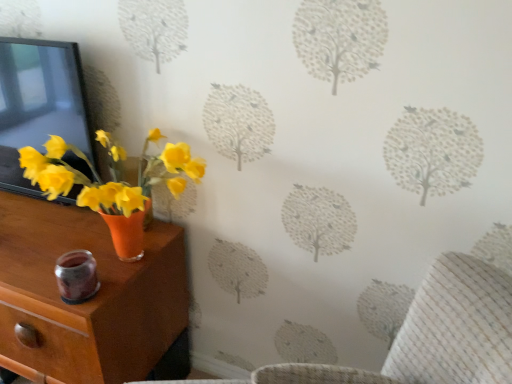
What do you see at coordinates (39, 104) in the screenshot?
I see `matte black picture frame at left` at bounding box center [39, 104].

This screenshot has height=384, width=512. Find the location of `matte black picture frame at left`. matte black picture frame at left is located at coordinates (39, 104).

Describe the element at coordinates (89, 300) in the screenshot. This screenshot has width=512, height=384. I see `orange matte vase at left` at that location.

Image resolution: width=512 pixels, height=384 pixels. I want to click on orange matte vase at left, so click(x=89, y=300).

In order to click on matte black picture frame at left in this screenshot , I will do `click(39, 104)`.

Considering the relative positions of matte black picture frame at left and orange matte vase at left in the image provided, is matte black picture frame at left to the left of orange matte vase at left from the viewer's perspective?

No.

Is the position of matte black picture frame at left more distant than that of orange matte vase at left?

Yes, the depth of matte black picture frame at left is greater than that of orange matte vase at left.

Considering the positions of point (72, 143) and point (16, 255), is point (72, 143) closer or farther from the camera than point (16, 255)?

Clearly, point (72, 143) is more distant from the camera than point (16, 255).

From the image's perspective, is matte black picture frame at left located above or below orange matte vase at left?

Clearly, from the image's perspective, matte black picture frame at left is above orange matte vase at left.

From a real-world perspective, is matte black picture frame at left over orange matte vase at left?

Indeed, from a real-world perspective, matte black picture frame at left stands above orange matte vase at left.

From the picture: Can you confirm if matte black picture frame at left is thinner than orange matte vase at left?

Yes, matte black picture frame at left is thinner than orange matte vase at left.

From their relative heights in the image, would you say matte black picture frame at left is taller or shorter than orange matte vase at left?

Considering their sizes, matte black picture frame at left has less height than orange matte vase at left.

Between matte black picture frame at left and orange matte vase at left, which one has smaller size?

matte black picture frame at left is smaller.

Could orange matte vase at left be considered to be inside matte black picture frame at left?

That's incorrect, orange matte vase at left is not inside matte black picture frame at left.

Is there a large distance between matte black picture frame at left and orange matte vase at left?

matte black picture frame at left is near orange matte vase at left, not far away.

Could you tell me if matte black picture frame at left is turned towards orange matte vase at left?

No.

How different are the orientations of matte black picture frame at left and orange matte vase at left in degrees?

There is a 2.09-degree angle between the facing directions of matte black picture frame at left and orange matte vase at left.

At what (x,y) coordinates should I click in order to perform the action: click on picture frame above the orange matte vase at left (from the image's perspective). Please return your answer as a coordinate pair (x, y). This screenshot has height=384, width=512. Looking at the image, I should click on (39, 104).

Is orange matte vase at left to the left of matte black picture frame at left from the viewer's perspective?

Correct, you'll find orange matte vase at left to the left of matte black picture frame at left.

Relative to matte black picture frame at left, is orange matte vase at left in front or behind?

In the image, orange matte vase at left appears in front of matte black picture frame at left.

Which is in front, point (55, 313) or point (2, 51)?

Point (55, 313)

From the image's perspective, does orange matte vase at left appear lower than matte black picture frame at left?

Yes, from the image's perspective, orange matte vase at left is beneath matte black picture frame at left.

From a real-world perspective, which object rests below the other?

In real-world perspective, orange matte vase at left is lower.

Is orange matte vase at left wider than matte black picture frame at left?

Yes.

Based on the photo, considering the relative sizes of orange matte vase at left and matte black picture frame at left in the image provided, is orange matte vase at left shorter than matte black picture frame at left?

Incorrect, the height of orange matte vase at left does not fall short of that of matte black picture frame at left.

Considering the sizes of objects orange matte vase at left and matte black picture frame at left in the image provided, who is bigger, orange matte vase at left or matte black picture frame at left?

Bigger between the two is orange matte vase at left.

Is matte black picture frame at left a part of orange matte vase at left?

No, matte black picture frame at left is not a part of orange matte vase at left.

Would you say orange matte vase at left is a long distance from matte black picture frame at left?

No, orange matte vase at left is not far away from matte black picture frame at left.

Is orange matte vase at left oriented towards matte black picture frame at left?

No, orange matte vase at left is not oriented towards matte black picture frame at left.

How different are the orientations of orange matte vase at left and matte black picture frame at left in degrees?

The angle between the facing direction of orange matte vase at left and the facing direction of matte black picture frame at left is 2.09 degrees.

Locate an element on the screen. nightstand that is on the left side of matte black picture frame at left is located at coordinates (89, 300).

You are a GUI agent. You are given a task and a screenshot of the screen. Output one action in this format:
    pyautogui.click(x=<x>, y=<y>)
    Task: Click on the nightstand in front of the matte black picture frame at left
    The height and width of the screenshot is (384, 512).
    Given the screenshot: What is the action you would take?
    pyautogui.click(x=89, y=300)

You are a GUI agent. You are given a task and a screenshot of the screen. Output one action in this format:
    pyautogui.click(x=<x>, y=<y>)
    Task: Click on the nightstand on the left of matte black picture frame at left
    The width and height of the screenshot is (512, 384).
    Given the screenshot: What is the action you would take?
    pyautogui.click(x=89, y=300)